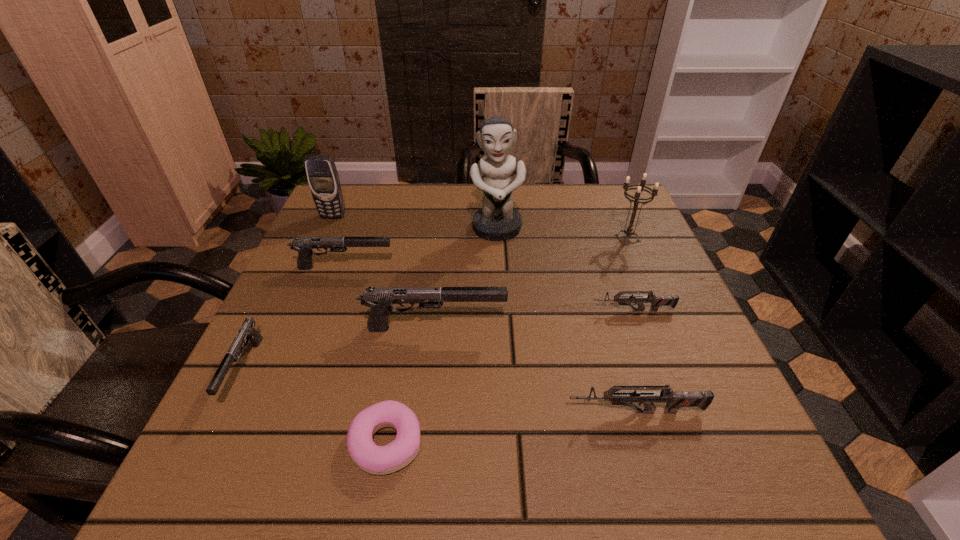
Where is `object that is at the near edge`? The image size is (960, 540). object that is at the near edge is located at coordinates (379, 460).

The width and height of the screenshot is (960, 540). Find the location of `cellular telephone positioned at the left edge`. cellular telephone positioned at the left edge is located at coordinates (323, 178).

At what (x,y) coordinates should I click in order to perform the action: click on candle holder located at the right edge. Please return your answer as a coordinate pair (x, y). Looking at the image, I should click on (629, 230).

Where is `object that is at the far left corner`? Image resolution: width=960 pixels, height=540 pixels. object that is at the far left corner is located at coordinates (323, 178).

This screenshot has width=960, height=540. What are the coordinates of `object present at the far right corner` in the screenshot? It's located at (629, 230).

Find the location of a particular element. This screenshot has width=960, height=540. vacant space at the far edge of the desktop is located at coordinates (477, 195).

Where is `free region at the left edge`? This screenshot has width=960, height=540. free region at the left edge is located at coordinates [x=214, y=431].

Identify the location of vacant region at the right edge of the desktop. The image size is (960, 540). (631, 249).

At what (x,y) coordinates should I click in order to perform the action: click on vacant space at the near left corner of the desktop. Please return your answer as a coordinate pair (x, y). The image size is (960, 540). Looking at the image, I should click on (206, 442).

Where is `free space at the far right corner of the desktop`? This screenshot has width=960, height=540. free space at the far right corner of the desktop is located at coordinates (591, 231).